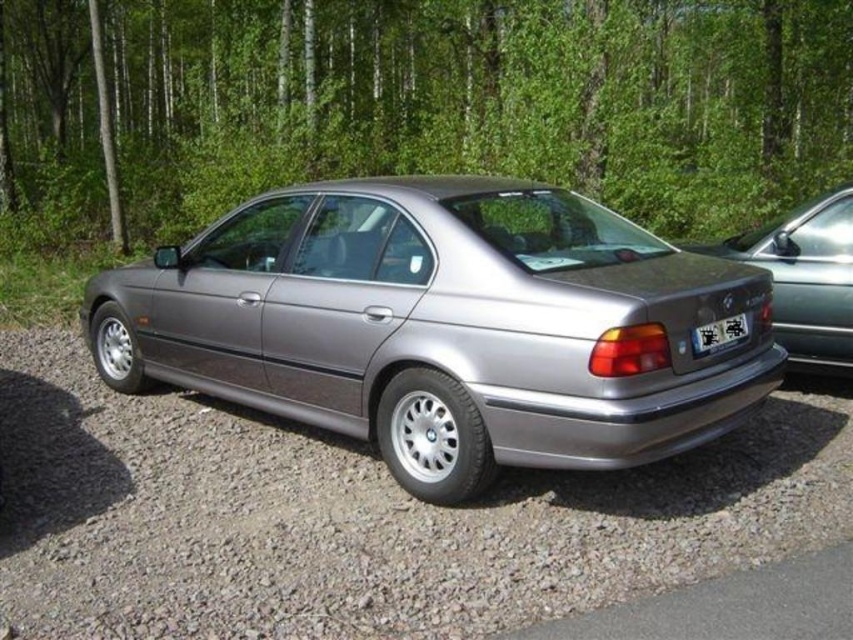
Question: Can you confirm if satin metallic car at center is thinner than gray gravel parking lot at lower left?

Choices:
 (A) no
 (B) yes

Answer: (A)

Question: Which object appears farthest from the camera in this image?

Choices:
 (A) black plastic license plate at rear
 (B) satin silver car at center
 (C) gray gravel parking lot at lower left
 (D) satin metallic car at center

Answer: (B)

Question: Which object appears closest to the camera in this image?

Choices:
 (A) black plastic license plate at rear
 (B) gray gravel at lower center
 (C) satin silver car at center
 (D) gray gravel parking lot at lower left

Answer: (D)

Question: Is satin metallic car at center smaller than black plastic license plate at rear?

Choices:
 (A) no
 (B) yes

Answer: (A)

Question: Among these objects, which one is nearest to the camera?

Choices:
 (A) satin silver car at center
 (B) black plastic license plate at rear
 (C) gray gravel at lower center
 (D) satin metallic car at center

Answer: (C)

Question: Is gray gravel at lower center to the left of gray gravel parking lot at lower left from the viewer's perspective?

Choices:
 (A) no
 (B) yes

Answer: (B)